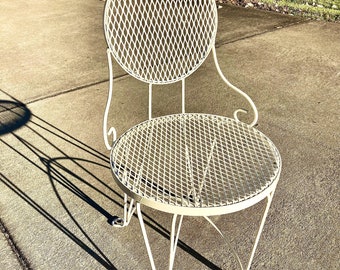
Where is `metal rod connecting seat of metal chair to back`? The height and width of the screenshot is (270, 340). metal rod connecting seat of metal chair to back is located at coordinates (111, 96).